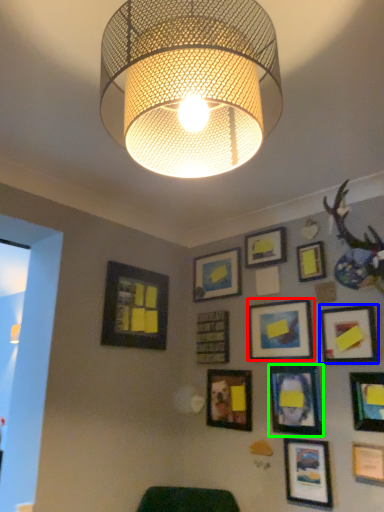
Question: Estimate the real-world distances between objects in this image. Which object is closer to picture frame (highlighted by a red box), picture frame (highlighted by a blue box) or picture frame (highlighted by a green box)?

Choices:
 (A) picture frame
 (B) picture frame

Answer: (B)